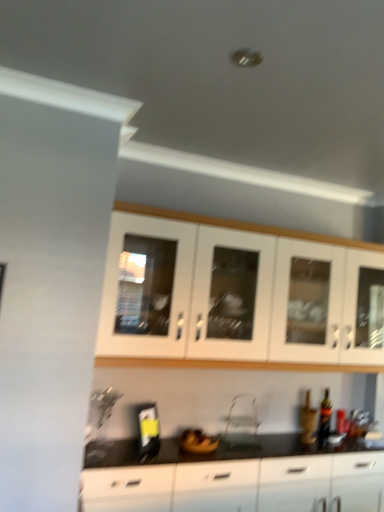
How much space does black glossy cabinet at lower center, the second cabinetry in the top-to-bottom sequence, occupy vertically?

black glossy cabinet at lower center, the second cabinetry in the top-to-bottom sequence, is 22.96 inches in height.

Locate an element on the screen. The width and height of the screenshot is (384, 512). black glossy cabinet at lower center, the second cabinetry in the top-to-bottom sequence is located at coordinates (242, 485).

From the picture: How many degrees apart are the facing directions of white glass cabinet at upper center, which is the 1th cabinetry from top to bottom, and clear plastic folding chair at center?

0.0495 degrees.

Is white glass cabinet at upper center, which is the 1th cabinetry from top to bottom, looking in the opposite direction of clear plastic folding chair at center?

white glass cabinet at upper center, which is the 1th cabinetry from top to bottom, is not turned away from clear plastic folding chair at center.

Consider the image. From a real-world perspective, who is located lower, white glass cabinet at upper center, placed as the second cabinetry when sorted from bottom to top, or clear plastic folding chair at center?

clear plastic folding chair at center.

Based on the photo, considering the relative sizes of white glass cabinet at upper center, which is the 1th cabinetry from top to bottom, and clear plastic folding chair at center in the image provided, is white glass cabinet at upper center, which is the 1th cabinetry from top to bottom, taller than clear plastic folding chair at center?

Yes.

Is white glass cabinet at upper center, which is the 1th cabinetry from top to bottom, next to black glossy cabinet at lower center, the second cabinetry in the top-to-bottom sequence?

There is a gap between white glass cabinet at upper center, which is the 1th cabinetry from top to bottom, and black glossy cabinet at lower center, the second cabinetry in the top-to-bottom sequence.

Measure the distance from white glass cabinet at upper center, placed as the second cabinetry when sorted from bottom to top, to black glossy cabinet at lower center, the second cabinetry in the top-to-bottom sequence.

They are 82.33 centimeters apart.

From the image's perspective, between white glass cabinet at upper center, which is the 1th cabinetry from top to bottom, and black glossy cabinet at lower center, the 1th cabinetry when ordered from bottom to top, who is located below?

black glossy cabinet at lower center, the 1th cabinetry when ordered from bottom to top, appears lower in the image.

Considering the sizes of objects white glass cabinet at upper center, which is the 1th cabinetry from top to bottom, and black glossy cabinet at lower center, the second cabinetry in the top-to-bottom sequence, in the image provided, who is wider, white glass cabinet at upper center, which is the 1th cabinetry from top to bottom, or black glossy cabinet at lower center, the second cabinetry in the top-to-bottom sequence,?

black glossy cabinet at lower center, the second cabinetry in the top-to-bottom sequence, is wider.

From the image's perspective, between black glossy cabinet at lower center, the 1th cabinetry when ordered from bottom to top, and clear plastic folding chair at center, who is located below?

Result: From the image's view, black glossy cabinet at lower center, the 1th cabinetry when ordered from bottom to top, is below.

Considering the sizes of black glossy cabinet at lower center, the 1th cabinetry when ordered from bottom to top, and clear plastic folding chair at center in the image, is black glossy cabinet at lower center, the 1th cabinetry when ordered from bottom to top, bigger or smaller than clear plastic folding chair at center?

Clearly, black glossy cabinet at lower center, the 1th cabinetry when ordered from bottom to top, is larger in size than clear plastic folding chair at center.

Is black glossy cabinet at lower center, the 1th cabinetry when ordered from bottom to top, not close to clear plastic folding chair at center?

No, black glossy cabinet at lower center, the 1th cabinetry when ordered from bottom to top, is in close proximity to clear plastic folding chair at center.

At what (x,y) coordinates should I click in order to perform the action: click on the 2nd cabinetry to the right of the clear plastic folding chair at center, starting your count from the anchor. Please return your answer as a coordinate pair (x, y). The height and width of the screenshot is (512, 384). Looking at the image, I should click on (231, 295).

Relative to white glass cabinet at upper center, which is the 1th cabinetry from top to bottom, is clear plastic folding chair at center in front or behind?

clear plastic folding chair at center is positioned farther from the viewer than white glass cabinet at upper center, which is the 1th cabinetry from top to bottom.

From the image's perspective, relative to white glass cabinet at upper center, which is the 1th cabinetry from top to bottom, is clear plastic folding chair at center above or below?

From the image's perspective, clear plastic folding chair at center appears below white glass cabinet at upper center, which is the 1th cabinetry from top to bottom.

Which is closer, (325,426) or (338,340)?

Point (325,426) appears to be farther away from the viewer than point (338,340).

From a real-world perspective, who is located lower, matte glass bottle at lower right or white glass cabinet at upper center, which is the 1th cabinetry from top to bottom?

In real-world perspective, matte glass bottle at lower right is lower.

Is the surface of matte glass bottle at lower right in direct contact with white glass cabinet at upper center, which is the 1th cabinetry from top to bottom?

No.

Which is behind, matte glass bottle at lower right or white glass cabinet at upper center, placed as the second cabinetry when sorted from bottom to top?

matte glass bottle at lower right.

Is matte glass bottle at lower right positioned before black glossy cabinet at lower center, the 1th cabinetry when ordered from bottom to top?

No, matte glass bottle at lower right is further to the viewer.

Is matte glass bottle at lower right positioned beyond the bounds of black glossy cabinet at lower center, the 1th cabinetry when ordered from bottom to top?

Absolutely, matte glass bottle at lower right is external to black glossy cabinet at lower center, the 1th cabinetry when ordered from bottom to top.

Which object is positioned more to the right, matte glass bottle at lower right or black glossy cabinet at lower center, the second cabinetry in the top-to-bottom sequence?

Positioned to the right is matte glass bottle at lower right.

From the image's perspective, which one is positioned lower, matte glass bottle at lower right or black glossy cabinet at lower center, the 1th cabinetry when ordered from bottom to top?

black glossy cabinet at lower center, the 1th cabinetry when ordered from bottom to top, appears lower in the image.

How many degrees apart are the facing directions of clear plastic folding chair at center and black glossy cabinet at lower center, the second cabinetry in the top-to-bottom sequence?

There is a 1.05-degree angle between the facing directions of clear plastic folding chair at center and black glossy cabinet at lower center, the second cabinetry in the top-to-bottom sequence.

Which of these two, clear plastic folding chair at center or black glossy cabinet at lower center, the 1th cabinetry when ordered from bottom to top, is thinner?

clear plastic folding chair at center is thinner.

Consider the image. Who is more distant, clear plastic folding chair at center or black glossy cabinet at lower center, the second cabinetry in the top-to-bottom sequence?

Positioned behind is clear plastic folding chair at center.

From the picture: Is clear plastic folding chair at center completely or partially outside of black glossy cabinet at lower center, the second cabinetry in the top-to-bottom sequence?

Absolutely, clear plastic folding chair at center is external to black glossy cabinet at lower center, the second cabinetry in the top-to-bottom sequence.

You are a GUI agent. You are given a task and a screenshot of the screen. Output one action in this format:
    pyautogui.click(x=<x>, y=<y>)
    Task: Click on the appliance that is on the left side of white glass cabinet at upper center, placed as the second cabinetry when sorted from bottom to top
    This screenshot has width=384, height=512.
    Given the screenshot: What is the action you would take?
    pyautogui.click(x=242, y=422)

You are a GUI agent. You are given a task and a screenshot of the screen. Output one action in this format:
    pyautogui.click(x=<x>, y=<y>)
    Task: Click on the cabinetry that is in front of the white glass cabinet at upper center, which is the 1th cabinetry from top to bottom
    This screenshot has height=512, width=384.
    Given the screenshot: What is the action you would take?
    pyautogui.click(x=242, y=485)

When comparing their distances from white glass cabinet at upper center, which is the 1th cabinetry from top to bottom, does clear plastic folding chair at center or black glossy cabinet at lower center, the second cabinetry in the top-to-bottom sequence, seem further?

black glossy cabinet at lower center, the second cabinetry in the top-to-bottom sequence.

When comparing their distances from white glass cabinet at upper center, placed as the second cabinetry when sorted from bottom to top, does matte glass bottle at lower right or black glossy cabinet at lower center, the 1th cabinetry when ordered from bottom to top, seem closer?

black glossy cabinet at lower center, the 1th cabinetry when ordered from bottom to top.

Looking at the image, which one is located closer to clear plastic folding chair at center, white glass cabinet at upper center, which is the 1th cabinetry from top to bottom, or matte glass bottle at lower right?

matte glass bottle at lower right.

Based on their spatial positions, is white glass cabinet at upper center, which is the 1th cabinetry from top to bottom, or matte glass bottle at lower right closer to black glossy cabinet at lower center, the 1th cabinetry when ordered from bottom to top?

Among the two, matte glass bottle at lower right is located nearer to black glossy cabinet at lower center, the 1th cabinetry when ordered from bottom to top.

Which object lies nearer to the anchor point clear plastic folding chair at center, white glass cabinet at upper center, placed as the second cabinetry when sorted from bottom to top, or black glossy cabinet at lower center, the 1th cabinetry when ordered from bottom to top?

black glossy cabinet at lower center, the 1th cabinetry when ordered from bottom to top, is positioned closer to the anchor clear plastic folding chair at center.

When comparing their distances from clear plastic folding chair at center, does black glossy cabinet at lower center, the 1th cabinetry when ordered from bottom to top, or matte glass bottle at lower right seem closer?

The object closer to clear plastic folding chair at center is black glossy cabinet at lower center, the 1th cabinetry when ordered from bottom to top.

From the image, which object appears to be nearer to matte glass bottle at lower right, black glossy cabinet at lower center, the second cabinetry in the top-to-bottom sequence, or white glass cabinet at upper center, which is the 1th cabinetry from top to bottom?

black glossy cabinet at lower center, the second cabinetry in the top-to-bottom sequence, lies closer to matte glass bottle at lower right than the other object.

From the image, which object appears to be nearer to black glossy cabinet at lower center, the 1th cabinetry when ordered from bottom to top, clear plastic folding chair at center or white glass cabinet at upper center, which is the 1th cabinetry from top to bottom?

clear plastic folding chair at center is positioned closer to the anchor black glossy cabinet at lower center, the 1th cabinetry when ordered from bottom to top.

You are a GUI agent. You are given a task and a screenshot of the screen. Output one action in this format:
    pyautogui.click(x=<x>, y=<y>)
    Task: Click on the appliance between black glossy cabinet at lower center, the second cabinetry in the top-to-bottom sequence, and matte glass bottle at lower right in the front-back direction
    
    Given the screenshot: What is the action you would take?
    pyautogui.click(x=242, y=422)

Where is `appliance between white glass cabinet at upper center, which is the 1th cabinetry from top to bottom, and black glossy cabinet at lower center, the second cabinetry in the top-to-bottom sequence, in the vertical direction`? The height and width of the screenshot is (512, 384). appliance between white glass cabinet at upper center, which is the 1th cabinetry from top to bottom, and black glossy cabinet at lower center, the second cabinetry in the top-to-bottom sequence, in the vertical direction is located at coordinates pos(242,422).

You are a GUI agent. You are given a task and a screenshot of the screen. Output one action in this format:
    pyautogui.click(x=<x>, y=<y>)
    Task: Click on the bottle between white glass cabinet at upper center, which is the 1th cabinetry from top to bottom, and black glossy cabinet at lower center, the 1th cabinetry when ordered from bottom to top, in the vertical direction
    
    Given the screenshot: What is the action you would take?
    pyautogui.click(x=324, y=419)

Find the location of `appliance between white glass cabinet at upper center, placed as the second cabinetry when sorted from bottom to top, and matte glass bottle at lower right vertically`. appliance between white glass cabinet at upper center, placed as the second cabinetry when sorted from bottom to top, and matte glass bottle at lower right vertically is located at coordinates (242, 422).